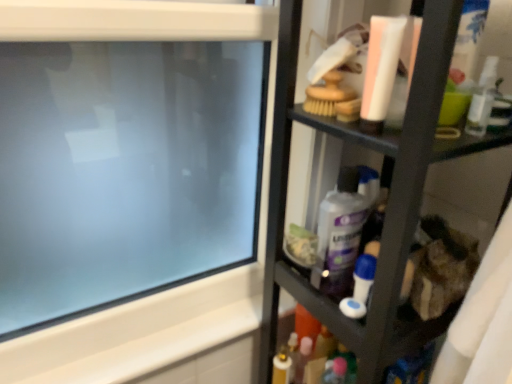
Question: From a real-world perspective, is black plastic shelf at right positioned over transparent glass computer screen at upper left based on gravity?

Choices:
 (A) yes
 (B) no

Answer: (B)

Question: Considering the relative positions of black plastic shelf at right and transparent glass computer screen at upper left in the image provided, is black plastic shelf at right in front of transparent glass computer screen at upper left?

Choices:
 (A) no
 (B) yes

Answer: (B)

Question: From the image's perspective, does black plastic shelf at right appear higher than transparent glass computer screen at upper left?

Choices:
 (A) yes
 (B) no

Answer: (B)

Question: Can you confirm if black plastic shelf at right is wider than transparent glass computer screen at upper left?

Choices:
 (A) yes
 (B) no

Answer: (A)

Question: Is black plastic shelf at right taller than transparent glass computer screen at upper left?

Choices:
 (A) no
 (B) yes

Answer: (B)

Question: Considering the relative sizes of black plastic shelf at right and transparent glass computer screen at upper left in the image provided, is black plastic shelf at right shorter than transparent glass computer screen at upper left?

Choices:
 (A) no
 (B) yes

Answer: (A)

Question: Can we say purple glossy bottle at center lies outside black plastic shelf at right?

Choices:
 (A) yes
 (B) no

Answer: (B)

Question: Is the position of purple glossy bottle at center less distant than that of black plastic shelf at right?

Choices:
 (A) yes
 (B) no

Answer: (B)

Question: From the image's perspective, is purple glossy bottle at center under black plastic shelf at right?

Choices:
 (A) no
 (B) yes

Answer: (A)

Question: From the image's perspective, is purple glossy bottle at center on black plastic shelf at right?

Choices:
 (A) no
 (B) yes

Answer: (B)

Question: Is purple glossy bottle at center bigger than black plastic shelf at right?

Choices:
 (A) no
 (B) yes

Answer: (A)

Question: Is purple glossy bottle at center not near black plastic shelf at right?

Choices:
 (A) no
 (B) yes

Answer: (A)

Question: From a real-world perspective, is blue plastic toothbrush at center-right on transparent glass computer screen at upper left?

Choices:
 (A) no
 (B) yes

Answer: (A)